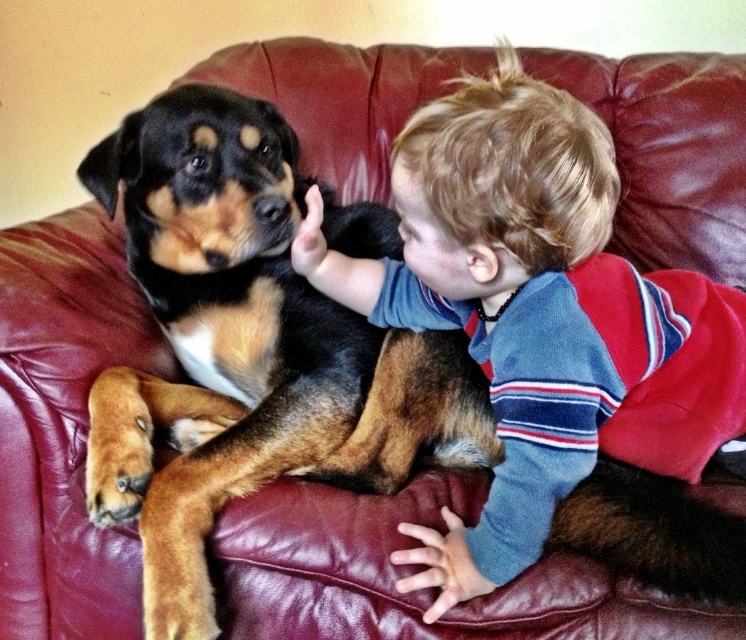
Based on the scene description, where exactly is the brown and black fur at center located in the image?

The brown and black fur at center is located at point coordinates of 0.547 on the x axis and 0.334 on the y axis.

You are a photographer trying to capture a closeup of the brown and black fur at center and the smooth blond hair at upper right. Which one would you need to zoom in more on to get a detailed shot?

The brown and black fur at center has a greater height compared to the smooth blond hair at upper right, so you would need to zoom in more on the smooth blond hair at upper right to get a detailed shot.

You are a photographer taking a picture of the brown and black fur at center and the smooth blond hair at upper right. Which object will appear closer to the camera in the photo?

The brown and black fur at center will appear closer to the camera because the smooth blond hair at upper right is behind it.